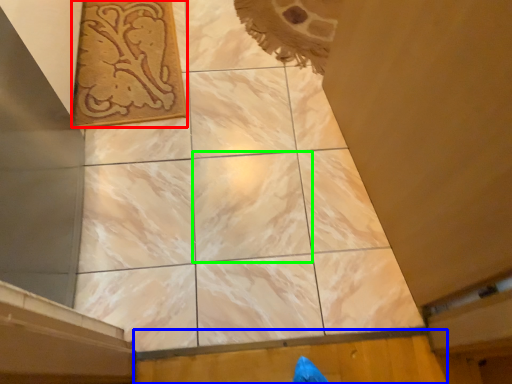
Question: Estimate the real-world distances between objects in this image. Which object is farther from design (highlighted by a red box), plywood (highlighted by a blue box) or tile (highlighted by a green box)?

Choices:
 (A) plywood
 (B) tile

Answer: (A)